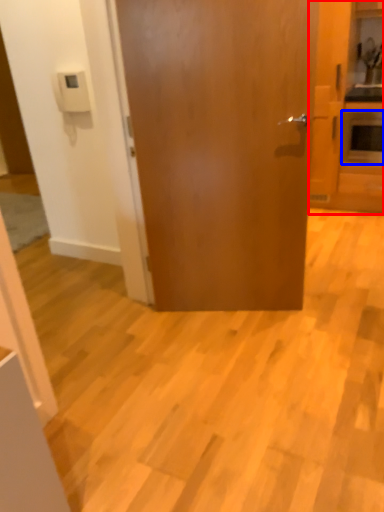
Question: Which of the following is the closest to the observer, cabinetry (highlighted by a red box) or appliance (highlighted by a blue box)?

Choices:
 (A) cabinetry
 (B) appliance

Answer: (A)